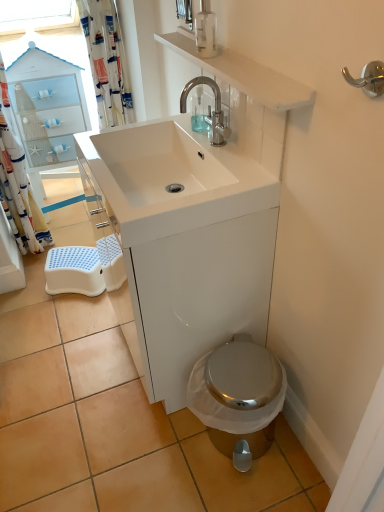
Question: Is white glossy sink at center oriented towards polished chrome hook at upper right?

Choices:
 (A) yes
 (B) no

Answer: (B)

Question: Is white glossy sink at center shorter than polished chrome hook at upper right?

Choices:
 (A) no
 (B) yes

Answer: (A)

Question: Is white glossy sink at center positioned beyond the bounds of polished chrome hook at upper right?

Choices:
 (A) no
 (B) yes

Answer: (B)

Question: From a real-world perspective, is white glossy sink at center positioned under polished chrome hook at upper right based on gravity?

Choices:
 (A) yes
 (B) no

Answer: (A)

Question: Considering the relative positions of white glossy sink at center and polished chrome hook at upper right in the image provided, is white glossy sink at center to the left of polished chrome hook at upper right from the viewer's perspective?

Choices:
 (A) no
 (B) yes

Answer: (B)

Question: Considering the relative positions of white glossy sink at center and polished chrome hook at upper right in the image provided, is white glossy sink at center behind polished chrome hook at upper right?

Choices:
 (A) yes
 (B) no

Answer: (A)

Question: Considering the relative sizes of polished chrome faucet at upper center and polished chrome hook at upper right in the image provided, is polished chrome faucet at upper center wider than polished chrome hook at upper right?

Choices:
 (A) yes
 (B) no

Answer: (A)

Question: Is polished chrome faucet at upper center positioned behind polished chrome hook at upper right?

Choices:
 (A) yes
 (B) no

Answer: (A)

Question: Is polished chrome faucet at upper center taller than polished chrome hook at upper right?

Choices:
 (A) yes
 (B) no

Answer: (A)

Question: From a real-world perspective, is polished chrome faucet at upper center beneath polished chrome hook at upper right?

Choices:
 (A) no
 (B) yes

Answer: (B)

Question: Are polished chrome faucet at upper center and polished chrome hook at upper right far apart?

Choices:
 (A) no
 (B) yes

Answer: (A)

Question: From the image's perspective, is polished chrome faucet at upper center located above polished chrome hook at upper right?

Choices:
 (A) no
 (B) yes

Answer: (B)

Question: Is transparent plastic soap dispenser at center, the second soap dispenser viewed from the front, further to camera compared to white fabric shower curtain at left, the 2th shower curtain viewed from the right?

Choices:
 (A) yes
 (B) no

Answer: (B)